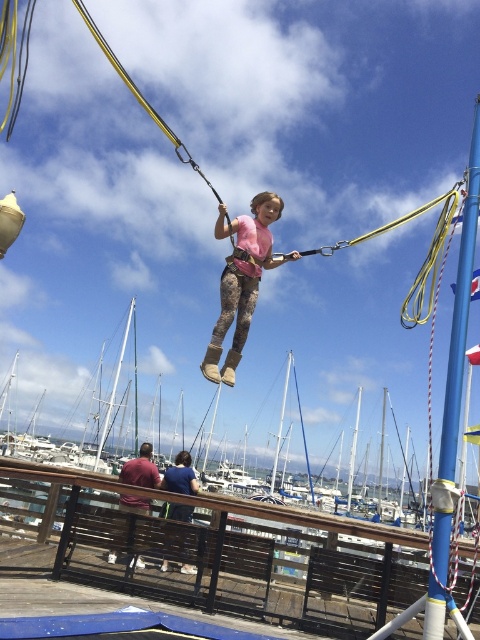
Question: Which is nearer to the camouflage leggings at center?

Choices:
 (A) blue painted metal pole at right
 (B) brown wooden dock at lower center

Answer: (B)

Question: Estimate the real-world distances between objects in this image. Which object is closer to the camouflage leggings at center?

Choices:
 (A) blue painted metal pole at right
 (B) brown wooden dock at lower center

Answer: (B)

Question: From the image, what is the correct spatial relationship of brown wooden dock at lower center in relation to blue painted metal pole at right?

Choices:
 (A) right
 (B) left

Answer: (B)

Question: Can you confirm if blue painted metal pole at right is thinner than camouflage leggings at center?

Choices:
 (A) no
 (B) yes

Answer: (A)

Question: Which point is farther from the camera taking this photo?

Choices:
 (A) click(x=308, y=605)
 (B) click(x=446, y=444)

Answer: (A)

Question: Where is blue painted metal pole at right located in relation to camouflage leggings at center in the image?

Choices:
 (A) below
 (B) above

Answer: (A)